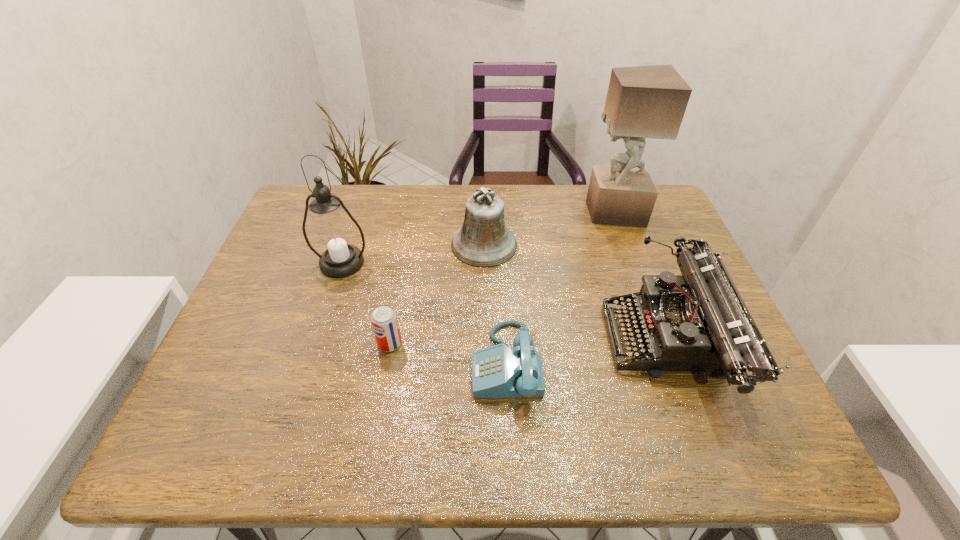
At what (x,y) coordinates should I click in order to perform the action: click on vacant space at the left edge of the desktop. Please return your answer as a coordinate pair (x, y). This screenshot has width=960, height=540. Looking at the image, I should click on (300, 275).

Identify the location of free space at the right edge of the desktop. The width and height of the screenshot is (960, 540). (745, 408).

Where is `free space at the far left corner of the desktop`? Image resolution: width=960 pixels, height=540 pixels. free space at the far left corner of the desktop is located at coordinates (306, 184).

Image resolution: width=960 pixels, height=540 pixels. In the image, there is a desktop. In order to click on vacant area at the near left corner in this screenshot , I will do `click(235, 460)`.

Identify the location of vacant space that is in between the bell and the tallest object. This screenshot has width=960, height=540. (549, 228).

Identify the location of free area in between the bell and the oil lamp. The image size is (960, 540). (413, 254).

I want to click on free space between the tallest object and the bell, so click(549, 228).

At what (x,y) coordinates should I click in order to perform the action: click on empty space that is in between the fifth tallest object and the bell. Please return your answer as a coordinate pair (x, y). The width and height of the screenshot is (960, 540). Looking at the image, I should click on (437, 294).

Where is `free spot between the leftmost object and the bell`? The width and height of the screenshot is (960, 540). free spot between the leftmost object and the bell is located at coordinates (413, 254).

At what (x,y) coordinates should I click in order to perform the action: click on free spot between the tallest object and the telephone. Please return your answer as a coordinate pair (x, y). This screenshot has height=540, width=960. Looking at the image, I should click on (560, 287).